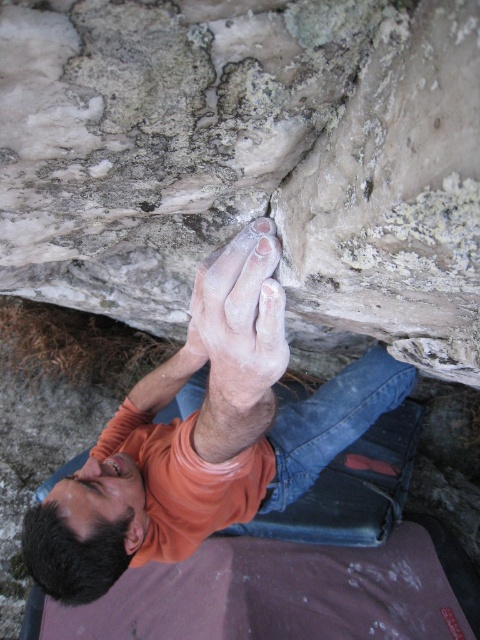
You are a photographer standing at a certain distance from the rock climbing scene. You want to capture a closeup shot of the dry skin at upper center. Considering your current position, can you estimate whether you need to move closer or farther away to focus on this specific detail?

The dry skin at upper center is 30.91 inches away from the viewer. To capture a closeup shot, you would need to move closer than 30.91 inches to focus on the dry skin at upper center.

You are a climber looking at the rock face. Where is the smooth gray rock at center located?

The smooth gray rock at center is located at point (x=250, y=164).

You are a rock climber planning your next move. You notice a point marked at coordinates point (250, 164). What type of rock feature is located there?

The point (250, 164) has a smooth gray rock at center.